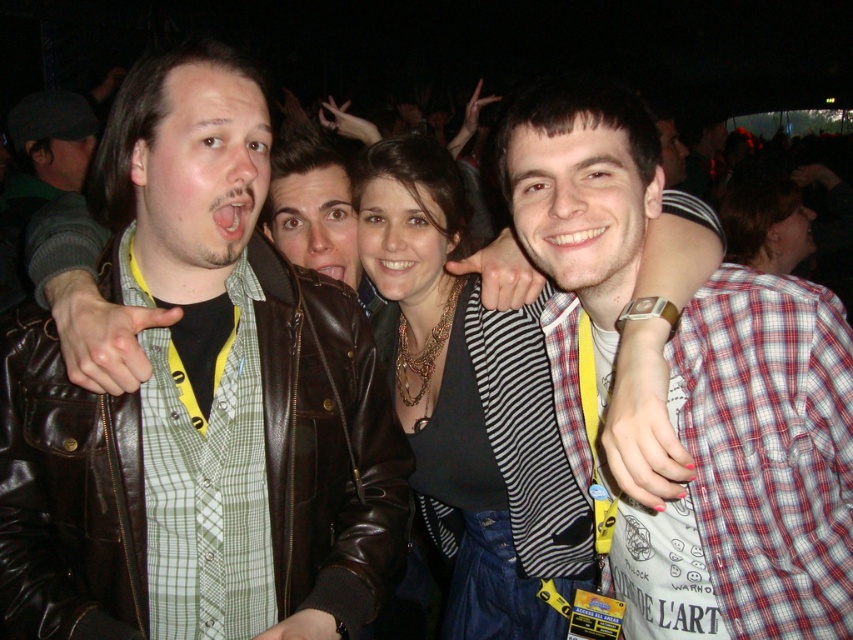
Question: Does matte brown leather jacket at left have a lesser width compared to matte black top at center?

Choices:
 (A) no
 (B) yes

Answer: (A)

Question: From the image, what is the correct spatial relationship of matte brown leather jacket at left in relation to matte black top at center?

Choices:
 (A) above
 (B) below

Answer: (A)

Question: Can you confirm if matte brown leather jacket at left is smaller than matte black top at center?

Choices:
 (A) no
 (B) yes

Answer: (B)

Question: Among these points, which one is nearest to the camera?

Choices:
 (A) (437, 540)
 (B) (6, 381)

Answer: (B)

Question: Which of the following is the closest to the observer?

Choices:
 (A) (294, 294)
 (B) (374, 147)

Answer: (A)

Question: Which point is farther to the camera?

Choices:
 (A) (396, 508)
 (B) (409, 262)

Answer: (B)